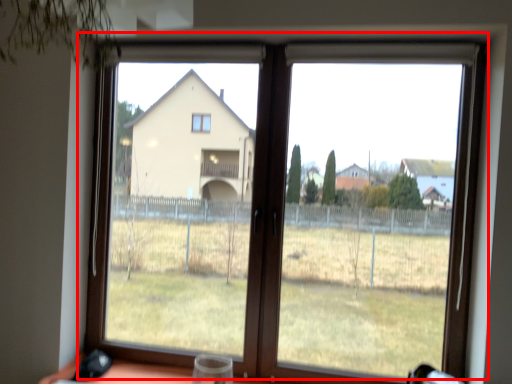
Question: Where is window (annotated by the red box) located in relation to wine glass in the image?

Choices:
 (A) right
 (B) left

Answer: (A)